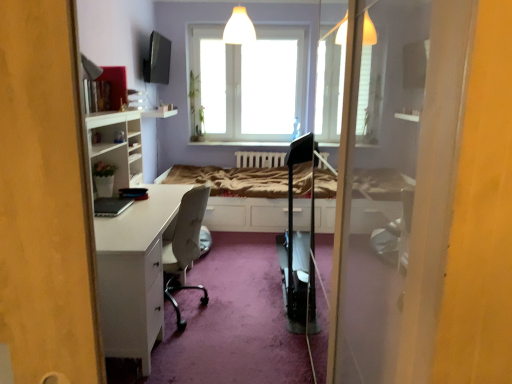
Question: From the image's perspective, would you say white wooden bed frame at center is positioned over transparent glass window at center?

Choices:
 (A) yes
 (B) no

Answer: (B)

Question: Can you confirm if white wooden bed frame at center is smaller than transparent glass window at center?

Choices:
 (A) yes
 (B) no

Answer: (B)

Question: Is white wooden bed frame at center turned away from transparent glass window at center?

Choices:
 (A) yes
 (B) no

Answer: (B)

Question: From a real-world perspective, does white wooden bed frame at center stand above transparent glass window at center?

Choices:
 (A) yes
 (B) no

Answer: (B)

Question: Does white wooden bed frame at center have a larger size compared to transparent glass window at center?

Choices:
 (A) yes
 (B) no

Answer: (A)

Question: From their relative heights in the image, would you say transparent glass window at center is taller or shorter than white wooden bed frame at center?

Choices:
 (A) tall
 (B) short

Answer: (A)

Question: Do you think transparent glass window at center is within white wooden bed frame at center, or outside of it?

Choices:
 (A) inside
 (B) outside

Answer: (B)

Question: Based on their positions, is transparent glass window at center located to the left or right of white wooden bed frame at center?

Choices:
 (A) right
 (B) left

Answer: (A)

Question: In terms of width, does transparent glass window at center look wider or thinner when compared to white wooden bed frame at center?

Choices:
 (A) wide
 (B) thin

Answer: (B)

Question: In terms of height, does white wooden bed frame at center look taller or shorter compared to white glossy desk at left?

Choices:
 (A) tall
 (B) short

Answer: (B)

Question: In terms of width, does white wooden bed frame at center look wider or thinner when compared to white glossy desk at left?

Choices:
 (A) wide
 (B) thin

Answer: (A)

Question: Based on their sizes in the image, would you say white wooden bed frame at center is bigger or smaller than white glossy desk at left?

Choices:
 (A) small
 (B) big

Answer: (B)

Question: Is white wooden bed frame at center inside the boundaries of white glossy desk at left, or outside?

Choices:
 (A) inside
 (B) outside

Answer: (B)

Question: Looking at the image, does white glossy desk at left seem bigger or smaller compared to transparent glass window at center?

Choices:
 (A) small
 (B) big

Answer: (A)

Question: From the image's perspective, is white glossy desk at left positioned above or below transparent glass window at center?

Choices:
 (A) above
 (B) below

Answer: (B)